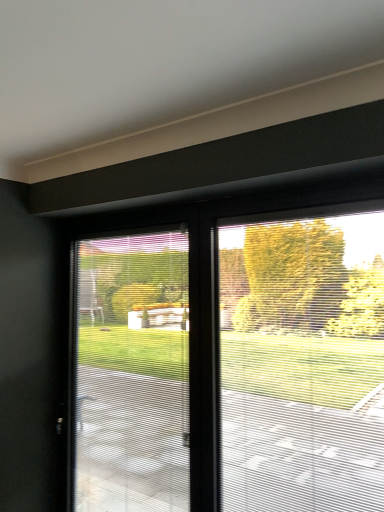
Find the location of `clear plastic window screen at center, which is the 1th window screen from left to right`. clear plastic window screen at center, which is the 1th window screen from left to right is located at coordinates (133, 374).

What do you see at coordinates (133, 374) in the screenshot? I see `clear plastic window screen at center, which is the 1th window screen from left to right` at bounding box center [133, 374].

The image size is (384, 512). Identify the location of frosted glass window screen at center, the first window screen when ordered from right to left. (303, 361).

What do you see at coordinates (303, 361) in the screenshot? I see `frosted glass window screen at center, which ranks as the second window screen in left-to-right order` at bounding box center [303, 361].

The image size is (384, 512). In order to click on clear plastic window screen at center, which is counted as the second window screen, starting from the right in this screenshot , I will do `click(133, 374)`.

Is clear plastic window screen at center, which is counted as the second window screen, starting from the right, at the left side of frosted glass window screen at center, the first window screen when ordered from right to left?

Correct, you'll find clear plastic window screen at center, which is counted as the second window screen, starting from the right, to the left of frosted glass window screen at center, the first window screen when ordered from right to left.

Is clear plastic window screen at center, which is counted as the second window screen, starting from the right, closer to the viewer compared to frosted glass window screen at center, which ranks as the second window screen in left-to-right order?

No, it is not.

Considering the points (134, 254) and (284, 371), which point is in front, point (134, 254) or point (284, 371)?

The point (134, 254) is closer to the camera.

From the image's perspective, which is above, clear plastic window screen at center, which is the 1th window screen from left to right, or frosted glass window screen at center, the first window screen when ordered from right to left?

frosted glass window screen at center, the first window screen when ordered from right to left, is shown above in the image.

From a real-world perspective, is clear plastic window screen at center, which is the 1th window screen from left to right, on frosted glass window screen at center, the first window screen when ordered from right to left?

Incorrect, from a real-world perspective, clear plastic window screen at center, which is the 1th window screen from left to right, is lower than frosted glass window screen at center, the first window screen when ordered from right to left.

Between clear plastic window screen at center, which is counted as the second window screen, starting from the right, and frosted glass window screen at center, the first window screen when ordered from right to left, which one has smaller width?

With smaller width is frosted glass window screen at center, the first window screen when ordered from right to left.

Who is taller, clear plastic window screen at center, which is counted as the second window screen, starting from the right, or frosted glass window screen at center, the first window screen when ordered from right to left?

clear plastic window screen at center, which is counted as the second window screen, starting from the right.

Who is bigger, clear plastic window screen at center, which is the 1th window screen from left to right, or frosted glass window screen at center, the first window screen when ordered from right to left?

With larger size is clear plastic window screen at center, which is the 1th window screen from left to right.

Could frosted glass window screen at center, the first window screen when ordered from right to left, be considered to be inside clear plastic window screen at center, which is counted as the second window screen, starting from the right?

No, frosted glass window screen at center, the first window screen when ordered from right to left, is not surrounded by clear plastic window screen at center, which is counted as the second window screen, starting from the right.

Is clear plastic window screen at center, which is counted as the second window screen, starting from the right, placed right next to frosted glass window screen at center, the first window screen when ordered from right to left?

There is a gap between clear plastic window screen at center, which is counted as the second window screen, starting from the right, and frosted glass window screen at center, the first window screen when ordered from right to left.

Is clear plastic window screen at center, which is the 1th window screen from left to right, oriented towards frosted glass window screen at center, which ranks as the second window screen in left-to-right order?

No, clear plastic window screen at center, which is the 1th window screen from left to right, is not turned towards frosted glass window screen at center, which ranks as the second window screen in left-to-right order.

How different are the orientations of clear plastic window screen at center, which is counted as the second window screen, starting from the right, and frosted glass window screen at center, which ranks as the second window screen in left-to-right order, in degrees?

There is a 0.00332-degree angle between the facing directions of clear plastic window screen at center, which is counted as the second window screen, starting from the right, and frosted glass window screen at center, which ranks as the second window screen in left-to-right order.

Measure the distance between clear plastic window screen at center, which is the 1th window screen from left to right, and frosted glass window screen at center, which ranks as the second window screen in left-to-right order.

The distance of clear plastic window screen at center, which is the 1th window screen from left to right, from frosted glass window screen at center, which ranks as the second window screen in left-to-right order, is 3.85 feet.

Where is `window screen behind the frosted glass window screen at center, the first window screen when ordered from right to left`? window screen behind the frosted glass window screen at center, the first window screen when ordered from right to left is located at coordinates (133, 374).

Considering the positions of objects frosted glass window screen at center, the first window screen when ordered from right to left, and clear plastic window screen at center, which is counted as the second window screen, starting from the right, in the image provided, who is more to the right, frosted glass window screen at center, the first window screen when ordered from right to left, or clear plastic window screen at center, which is counted as the second window screen, starting from the right,?

frosted glass window screen at center, the first window screen when ordered from right to left, is more to the right.

Which object is further away from the camera, frosted glass window screen at center, the first window screen when ordered from right to left, or clear plastic window screen at center, which is counted as the second window screen, starting from the right?

clear plastic window screen at center, which is counted as the second window screen, starting from the right, is further from the camera.

Which point is more distant from viewer, (282, 451) or (121, 284)?

The point (121, 284) is farther from the camera.

From the image's perspective, does frosted glass window screen at center, which ranks as the second window screen in left-to-right order, appear higher than clear plastic window screen at center, which is counted as the second window screen, starting from the right?

Correct, frosted glass window screen at center, which ranks as the second window screen in left-to-right order, appears higher than clear plastic window screen at center, which is counted as the second window screen, starting from the right, in the image.

From a real-world perspective, which is physically below, frosted glass window screen at center, which ranks as the second window screen in left-to-right order, or clear plastic window screen at center, which is counted as the second window screen, starting from the right?

clear plastic window screen at center, which is counted as the second window screen, starting from the right.

Looking at their sizes, would you say frosted glass window screen at center, the first window screen when ordered from right to left, is wider or thinner than clear plastic window screen at center, which is the 1th window screen from left to right?

Considering their sizes, frosted glass window screen at center, the first window screen when ordered from right to left, looks slimmer than clear plastic window screen at center, which is the 1th window screen from left to right.

Is frosted glass window screen at center, which ranks as the second window screen in left-to-right order, taller than clear plastic window screen at center, which is counted as the second window screen, starting from the right?

No, frosted glass window screen at center, which ranks as the second window screen in left-to-right order, is not taller than clear plastic window screen at center, which is counted as the second window screen, starting from the right.

Which of these two, frosted glass window screen at center, which ranks as the second window screen in left-to-right order, or clear plastic window screen at center, which is the 1th window screen from left to right, is smaller?

Smaller between the two is frosted glass window screen at center, which ranks as the second window screen in left-to-right order.

Is frosted glass window screen at center, the first window screen when ordered from right to left, completely or partially outside of clear plastic window screen at center, which is counted as the second window screen, starting from the right?

frosted glass window screen at center, the first window screen when ordered from right to left, lies outside clear plastic window screen at center, which is counted as the second window screen, starting from the right,'s area.

Are frosted glass window screen at center, the first window screen when ordered from right to left, and clear plastic window screen at center, which is counted as the second window screen, starting from the right, located far from each other?

frosted glass window screen at center, the first window screen when ordered from right to left, is far away from clear plastic window screen at center, which is counted as the second window screen, starting from the right.

Is clear plastic window screen at center, which is the 1th window screen from left to right, at the back of frosted glass window screen at center, the first window screen when ordered from right to left?

No, clear plastic window screen at center, which is the 1th window screen from left to right, is not at the back of frosted glass window screen at center, the first window screen when ordered from right to left.

In the scene shown: What's the angular difference between frosted glass window screen at center, which ranks as the second window screen in left-to-right order, and clear plastic window screen at center, which is the 1th window screen from left to right,'s facing directions?

0.00332 degrees separate the facing orientations of frosted glass window screen at center, which ranks as the second window screen in left-to-right order, and clear plastic window screen at center, which is the 1th window screen from left to right.

The image size is (384, 512). In order to click on window screen lying on the right of clear plastic window screen at center, which is the 1th window screen from left to right in this screenshot , I will do `click(303, 361)`.

Locate an element on the screen. This screenshot has height=512, width=384. window screen on the left side of frosted glass window screen at center, which ranks as the second window screen in left-to-right order is located at coordinates (133, 374).

I want to click on window screen in front of the clear plastic window screen at center, which is counted as the second window screen, starting from the right, so click(x=303, y=361).